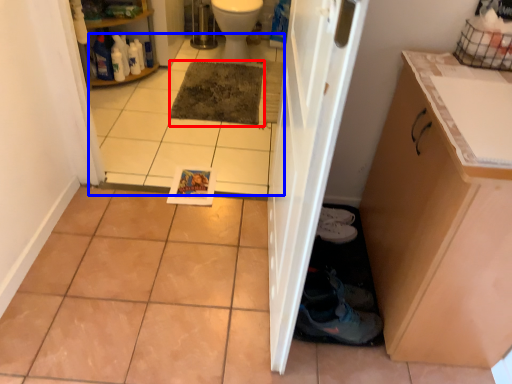
Question: Which object is closer to the camera taking this photo, mat (highlighted by a red box) or tile (highlighted by a blue box)?

Choices:
 (A) mat
 (B) tile

Answer: (B)